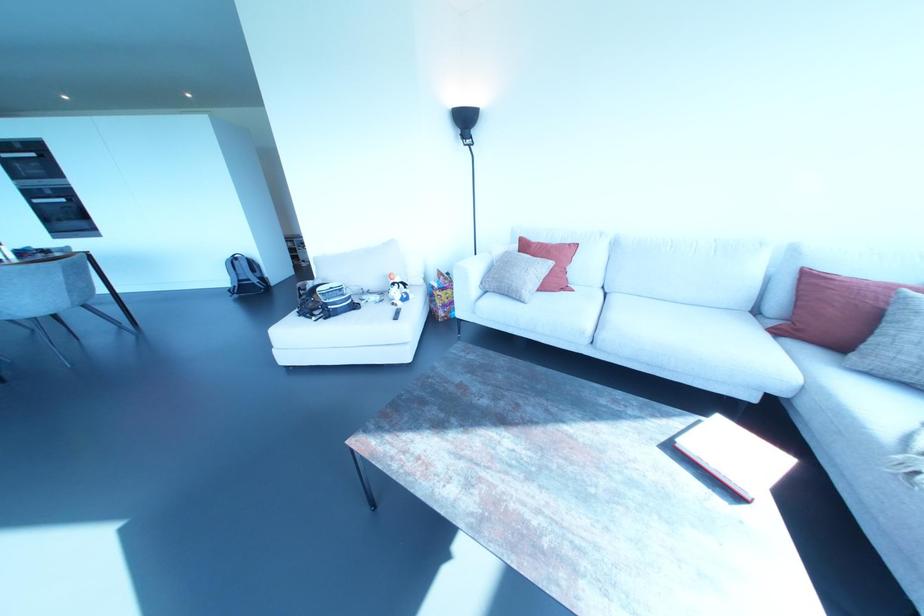
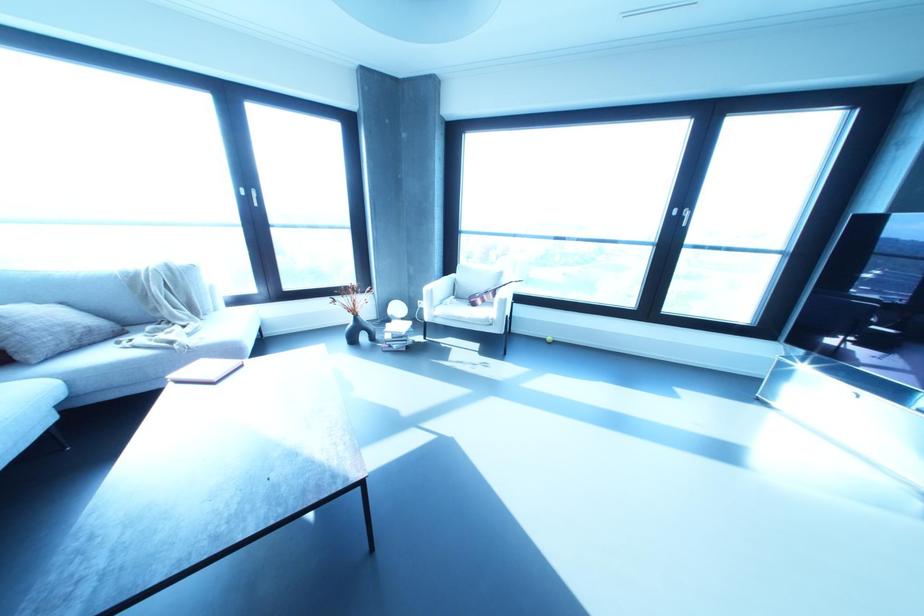
Locate, in the second image, the point that corresponds to point 733,495 in the first image.

(241, 365)